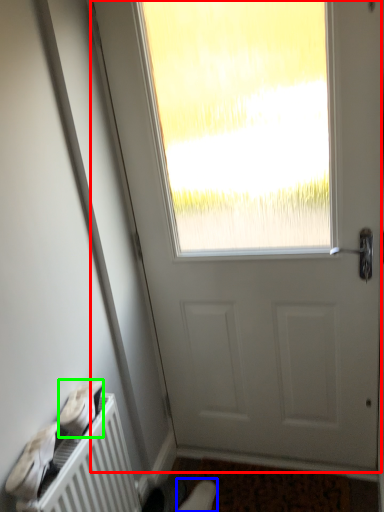
Question: Which object is the farthest from door (highlighted by a red box)? Choose among these: shoe (highlighted by a blue box) or shoe (highlighted by a green box).

Choices:
 (A) shoe
 (B) shoe

Answer: (A)